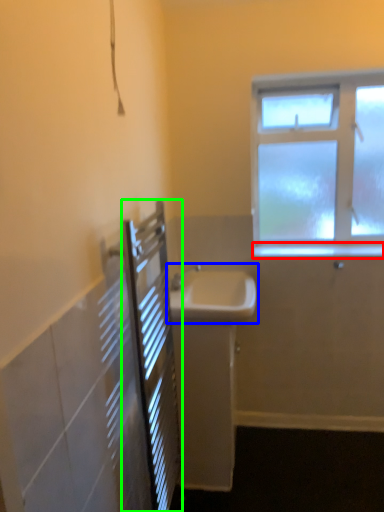
Question: Considering the real-world distances, which object is closest to window sill (highlighted by a red box)? sink (highlighted by a blue box) or screen door (highlighted by a green box).

Choices:
 (A) sink
 (B) screen door

Answer: (A)